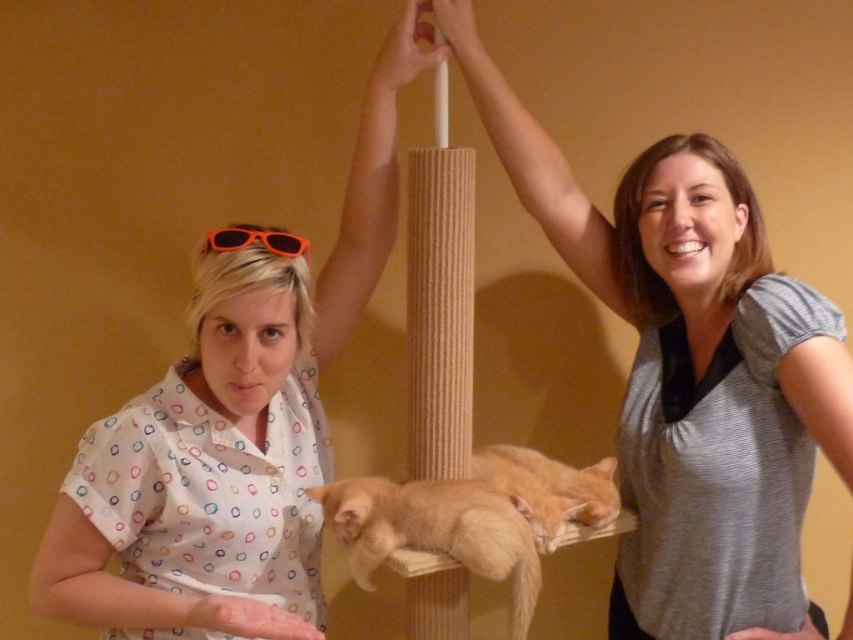
You are trying to decide which of the two items at the center of the image is bigger. You see the gray matte shirt at center and the orange fur cat at center. Based on their sizes, which one is bigger?

The gray matte shirt at center is larger in size than the orange fur cat at center.

You are trying to decide which of the two items at the center of the image is wider. You see the gray matte shirt at center and the orange fur cat at center. Which one has a greater width?

The gray matte shirt at center has a greater width than the orange fur cat at center according to the description.

You are a delivery person standing 1.5 meters away from the cat tree. You need to place a package on the gray matte shirt at center. Can you reach it without moving closer?

The gray matte shirt at center is 1.10 meters away from the camera. Since you are 1.5 meters away from the cat tree, you are farther than the shirt, so you cannot reach it without moving closer.